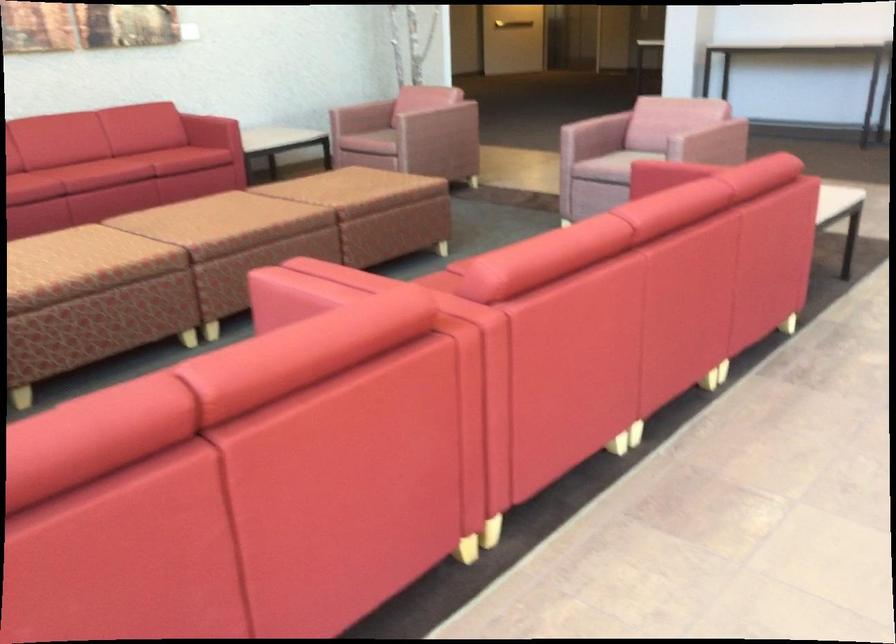
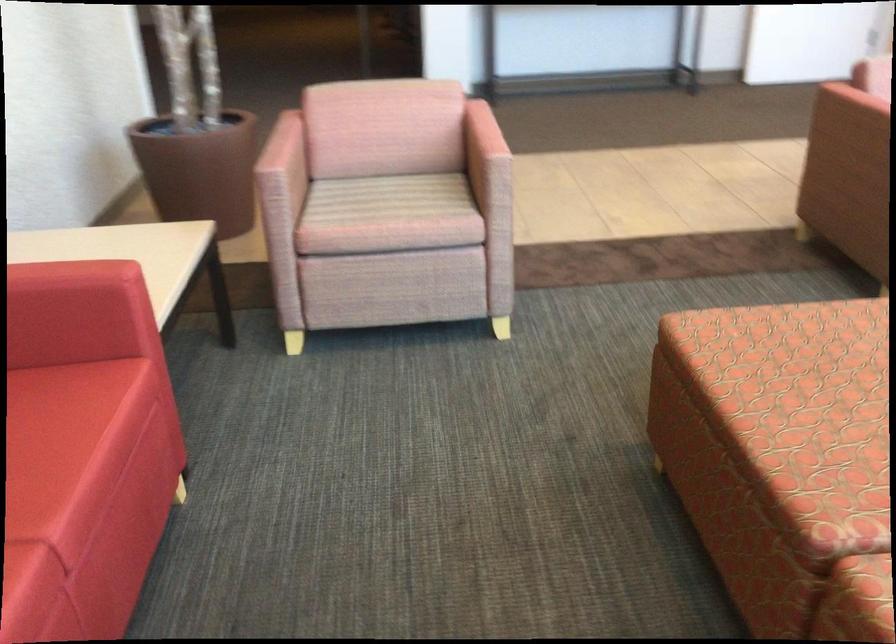
Locate, in the second image, the point that corresponds to point 419,108 in the first image.

(481, 133)